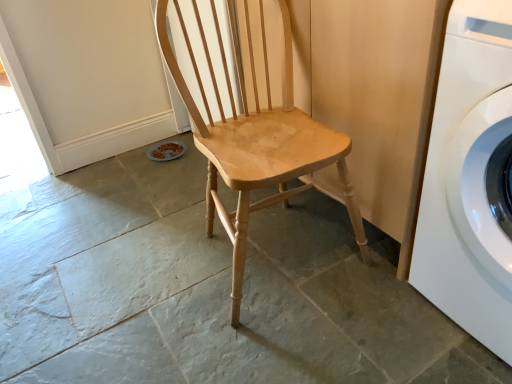
Where is `free space that is to the left of natural wood chair at center`? The width and height of the screenshot is (512, 384). free space that is to the left of natural wood chair at center is located at coordinates (140, 282).